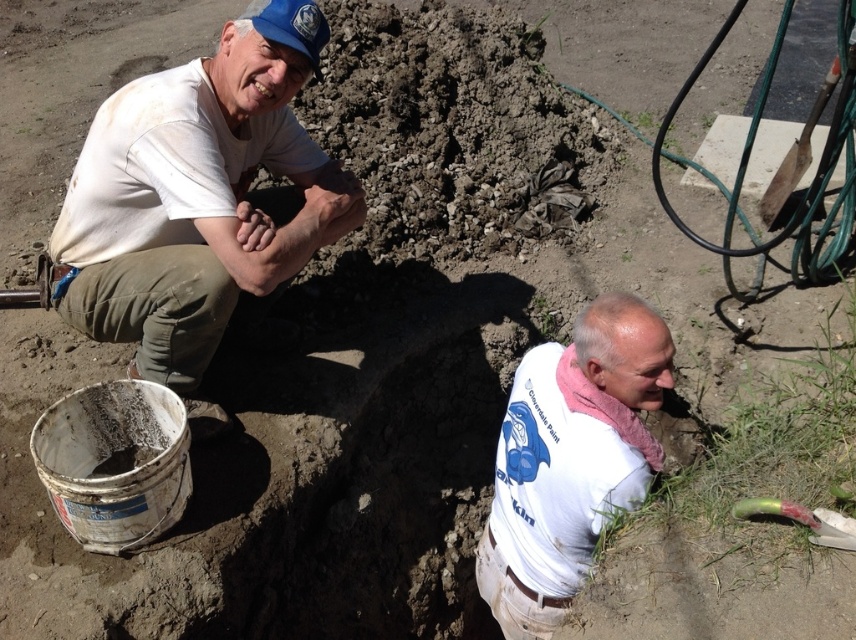
You are a construction supervisor observing the workers in the scene. Which worker is positioned closer to the front of the work area, the white matte shirt at upper left or the white cotton shirt at lower right?

The white matte shirt at upper left is positioned closer to the front of the work area because it is in front of the white cotton shirt at lower right.

You are an observer standing in front of the scene. You notice two shirts in the image. Which one is taller between the white matte shirt at upper left and the white cotton shirt at lower right?

The white matte shirt at upper left is taller than the white cotton shirt at lower right.

Based on the scene description, what are the coordinates of the white matte shirt at upper left?

The white matte shirt at upper left is located at coordinates point (x=199, y=200).